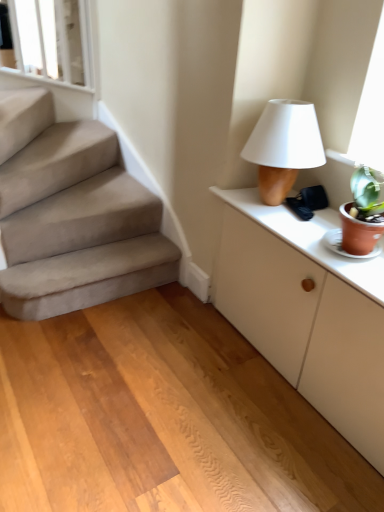
Question: From the image's perspective, is matte brown table lamp at upper right above or below wooden floor at center?

Choices:
 (A) below
 (B) above

Answer: (B)

Question: From a real-world perspective, is matte brown table lamp at upper right above or below wooden floor at center?

Choices:
 (A) above
 (B) below

Answer: (A)

Question: Considering the real-world distances, which object is farthest from the white matte cabinet at right?

Choices:
 (A) white glossy window frame at upper left
 (B) wooden floor at center
 (C) white matte cabinet at right
 (D) matte brown table lamp at upper right

Answer: (A)

Question: Which object is the farthest from the white glossy window frame at upper left?

Choices:
 (A) wooden floor at center
 (B) matte brown table lamp at upper right
 (C) white matte cabinet at right
 (D) white matte cabinet at right

Answer: (C)